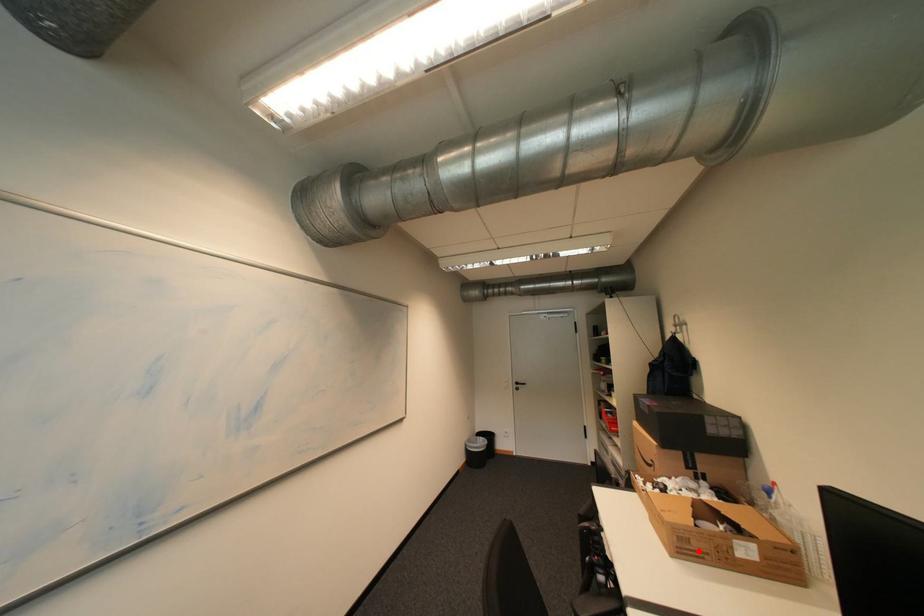
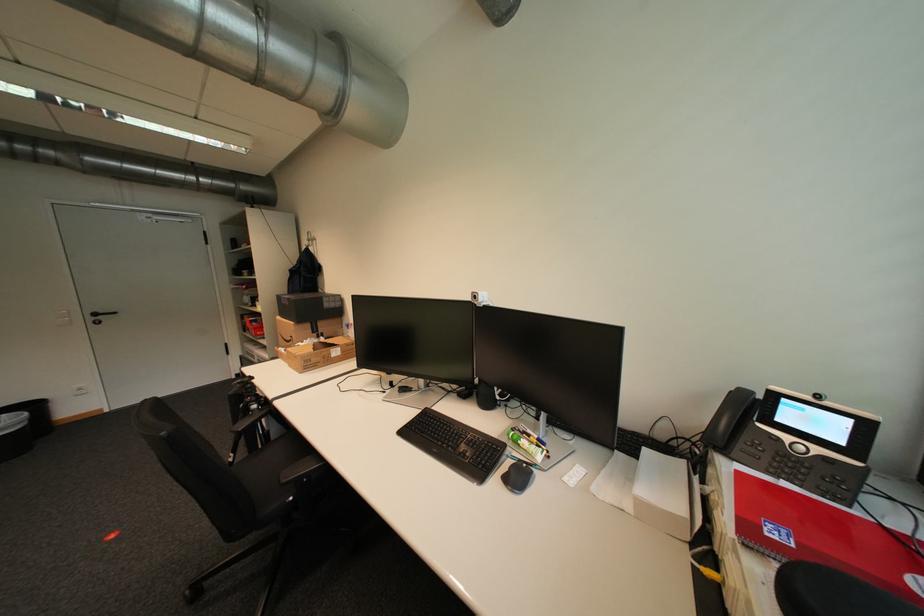
In the second image, find the point that corresponds to the highlighted location in the first image.

(319, 365)